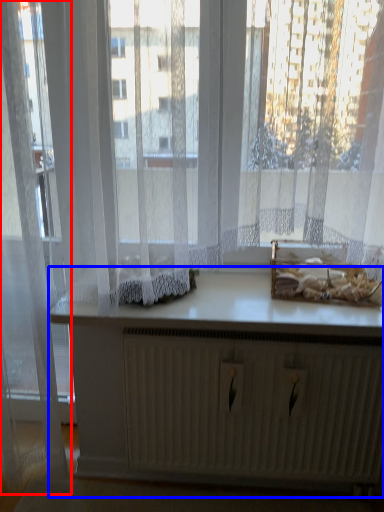
Question: Which object is closer to the camera taking this photo, curtain (highlighted by a red box) or vanity (highlighted by a blue box)?

Choices:
 (A) curtain
 (B) vanity

Answer: (A)